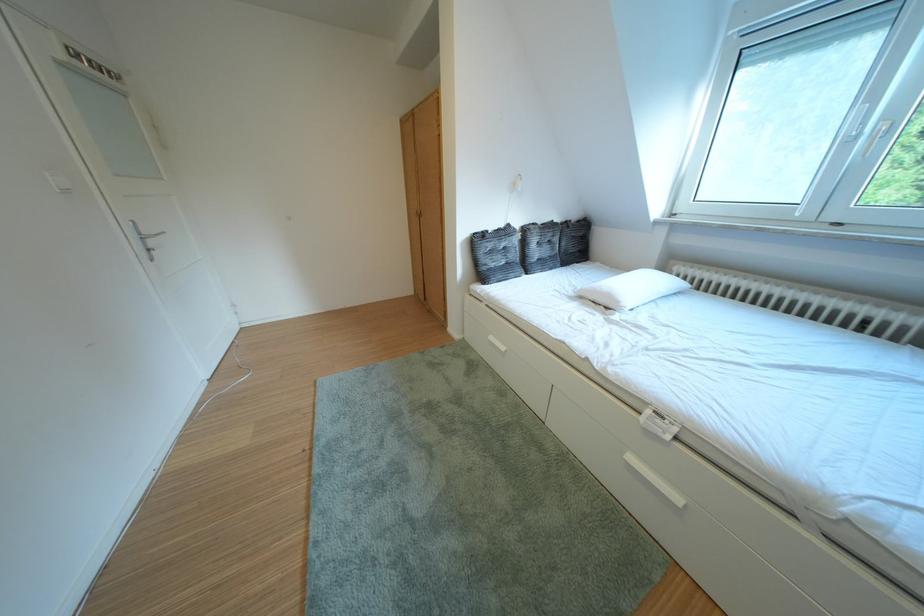
The width and height of the screenshot is (924, 616). What do you see at coordinates (881, 130) in the screenshot?
I see `the white window handle` at bounding box center [881, 130].